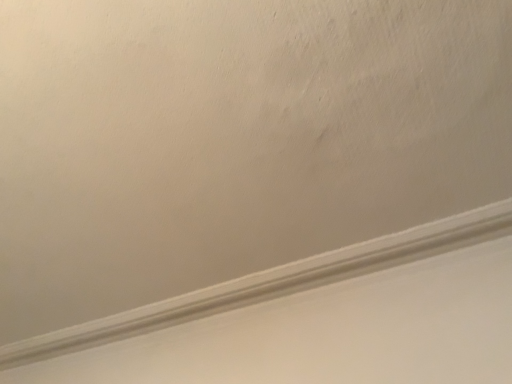
The width and height of the screenshot is (512, 384). Describe the element at coordinates (272, 282) in the screenshot. I see `white smooth wood at bottom` at that location.

Locate an element on the screen. This screenshot has height=384, width=512. white smooth wood at bottom is located at coordinates (272, 282).

Locate an element on the screen. Image resolution: width=512 pixels, height=384 pixels. white smooth wood at bottom is located at coordinates (x=272, y=282).